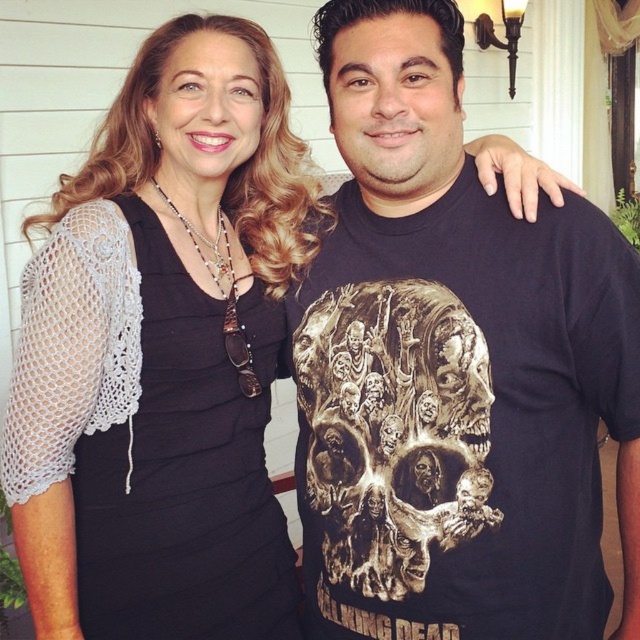
You are a photographer setting up for a portrait. You have a camera with a focal length of 50mm. You want to capture both the black crochet dress at left and the gold metallic skull at center in the same frame without any distortion. What is the minimum distance you should stand from the subjects to ensure both fit comfortably in the frame?

The black crochet dress at left and gold metallic skull at center are 8.69 inches apart. To capture both in a 50mm focal length without distortion, the photographer should maintain a distance of at least 43.45 inches. This ensures the 8.69 inch separation fits within the camera frame comfortably.

You are standing at the camera position and want to take a photo of the point at coordinates point (321, 33). Is this point within your field of view?

The point (321, 33) is 1.09 meters from the camera, so yes, it is within the field of view.